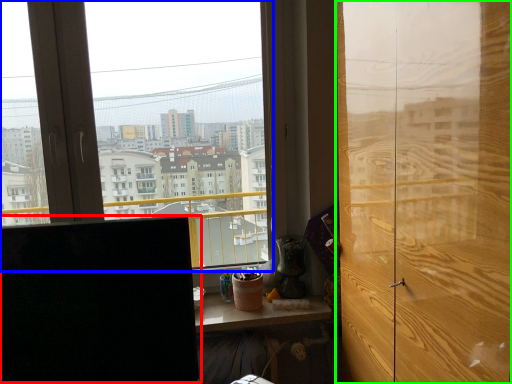
Question: Which object is positioned closest to computer monitor (highlighted by a red box)? Select from window (highlighted by a blue box) and door (highlighted by a green box).

Choices:
 (A) window
 (B) door

Answer: (B)